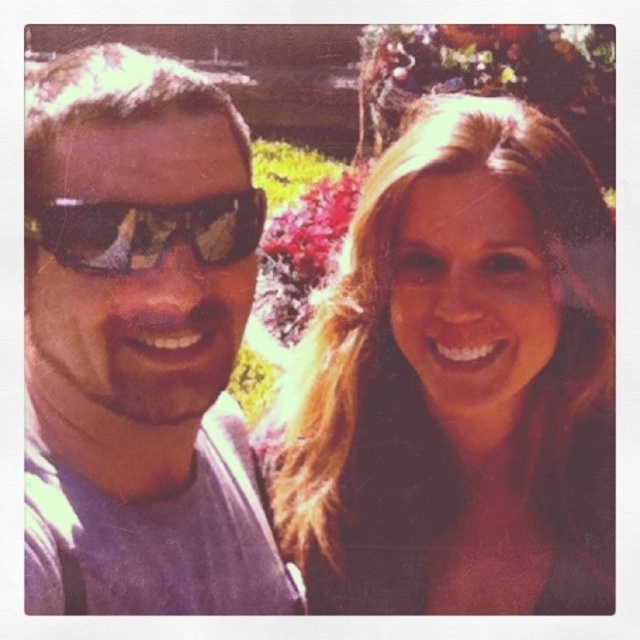
Question: Is blonde hair at center closer to camera compared to black reflective sunglasses at left?

Choices:
 (A) no
 (B) yes

Answer: (A)

Question: Which of the following is the farthest from the observer?

Choices:
 (A) (120, 348)
 (B) (544, 145)
 (C) (113, 230)

Answer: (B)

Question: From the image, what is the correct spatial relationship of matte gray shirt at left in relation to black reflective sunglasses at left?

Choices:
 (A) left
 (B) right

Answer: (A)

Question: Which point is farther to the camera?

Choices:
 (A) matte gray shirt at left
 (B) black reflective sunglasses at left
 (C) blonde hair at center

Answer: (C)

Question: Which of the following is the farthest from the observer?

Choices:
 (A) blonde hair at center
 (B) black reflective sunglasses at left
 (C) matte gray shirt at left

Answer: (A)

Question: Does blonde hair at center appear on the right side of black reflective sunglasses at left?

Choices:
 (A) yes
 (B) no

Answer: (A)